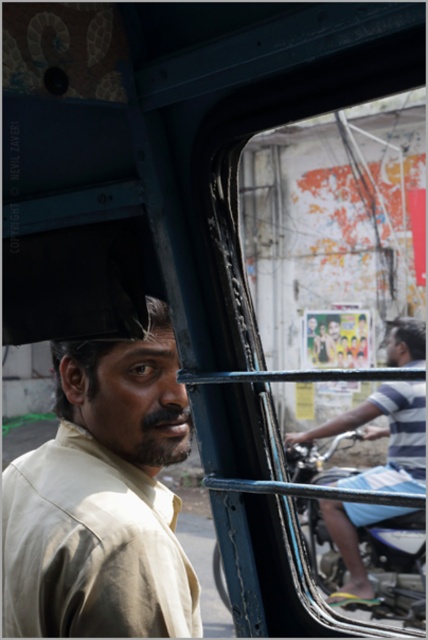
Does beige fabric shirt at left appear under striped fabric shirt at right?

Actually, beige fabric shirt at left is above striped fabric shirt at right.

Does beige fabric shirt at left have a greater width compared to striped fabric shirt at right?

Incorrect, beige fabric shirt at left's width does not surpass striped fabric shirt at right's.

Which is behind, point (121, 636) or point (410, 328)?

Point (410, 328)

The height and width of the screenshot is (640, 428). Find the location of `beige fabric shirt at left`. beige fabric shirt at left is located at coordinates (103, 499).